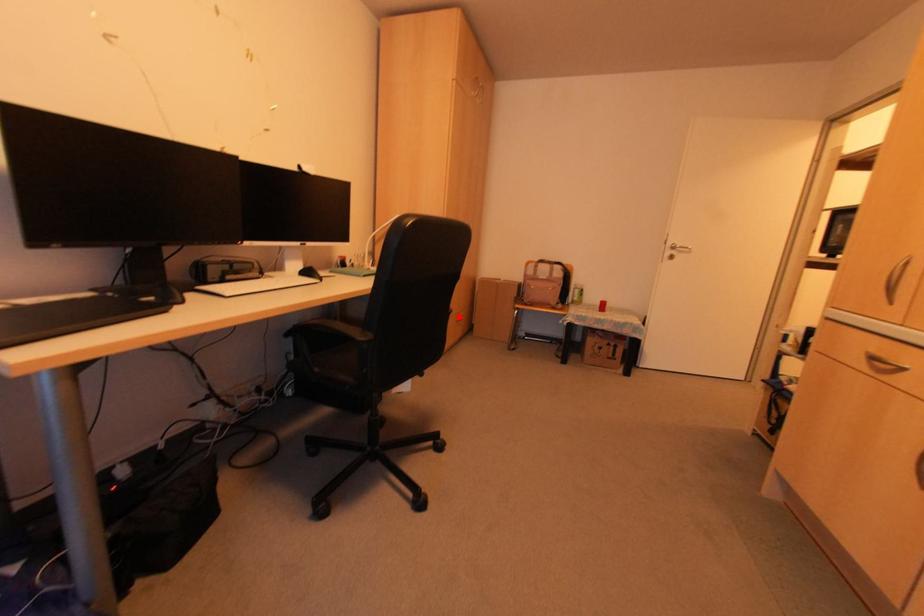
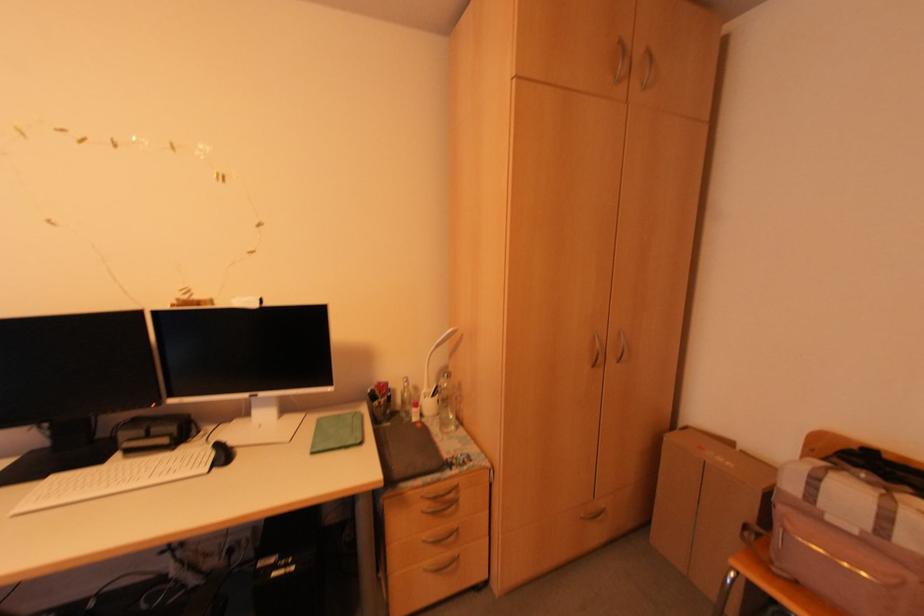
Where in the second image is the point corresponding to the highlighted location from the first image?

(602, 506)